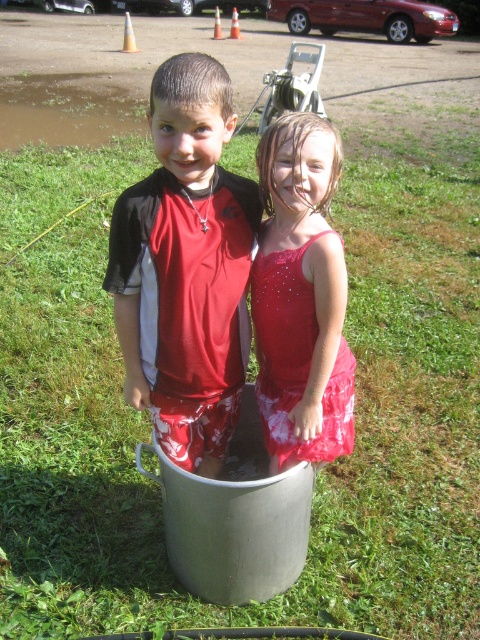
Question: Observing the image, what is the correct spatial positioning of matte red shirt at center in reference to sparkly red dress at center?

Choices:
 (A) left
 (B) right

Answer: (A)

Question: Is matte red shirt at center to the left of sparkly red dress at center from the viewer's perspective?

Choices:
 (A) yes
 (B) no

Answer: (A)

Question: Among these points, which one is farthest from the camera?

Choices:
 (A) (137, 404)
 (B) (259, 289)

Answer: (A)

Question: Among these points, which one is farthest from the camera?

Choices:
 (A) (159, 445)
 (B) (324, 376)

Answer: (A)

Question: Is matte red shirt at center thinner than sparkly red dress at center?

Choices:
 (A) no
 (B) yes

Answer: (A)